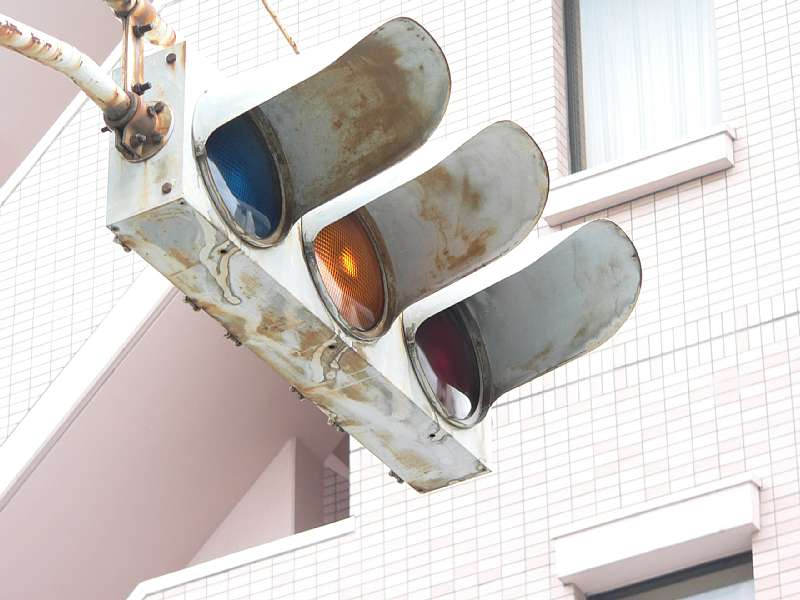
Locate an element on the screen. Image resolution: width=800 pixels, height=600 pixels. pink wall is located at coordinates (201, 414).